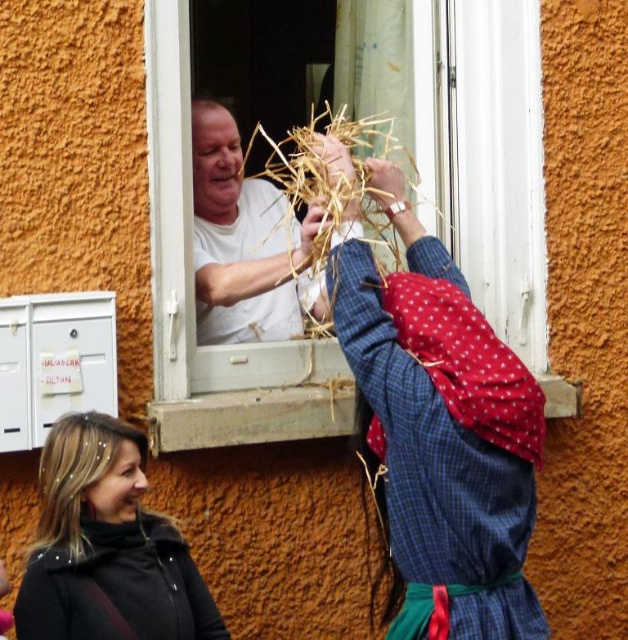
Looking at this image, what is the object located at the coordinates point [489,164]?

The object located at point [489,164] is the white plastic window at center.

You are a delivery robot with a package that needs to be passed between the black leather jacket at lower left and the white matte shirt at upper center. The package is 38 inches long. Can you fit the package between them without bending it?

The distance between the black leather jacket at lower left and the white matte shirt at upper center is 37.71 inches, which is shorter than the 38 inch package. Therefore, the package cannot be fit between them without bending.